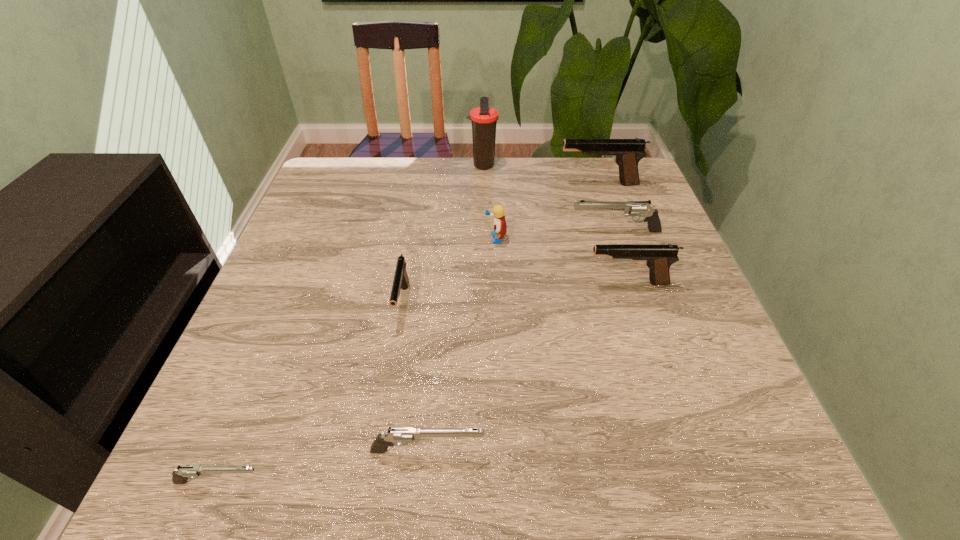
This screenshot has width=960, height=540. In order to click on vacant space that is in between the Lego and the biggest black pistol in this screenshot , I will do `click(547, 212)`.

I want to click on unoccupied position between the farthest object and the Lego, so click(489, 202).

Identify the location of free space between the second tallest object and the fifth shortest pistol. This screenshot has width=960, height=540. (612, 234).

Where is `free spot between the seventh farthest object and the leftmost black pistol`? The height and width of the screenshot is (540, 960). free spot between the seventh farthest object and the leftmost black pistol is located at coordinates (415, 377).

Identify the location of vacant space in between the Lego and the tallest pistol. (547, 212).

This screenshot has width=960, height=540. What are the coordinates of `vacant point located between the leftmost silver pistol and the second nearest pistol` in the screenshot? It's located at (324, 467).

Where is `vacant space in between the Lego and the smallest silver pistol`? vacant space in between the Lego and the smallest silver pistol is located at coordinates (357, 361).

Locate an element on the screen. The width and height of the screenshot is (960, 540). free space between the fifth shortest pistol and the tallest pistol is located at coordinates pyautogui.click(x=612, y=234).

You are a GUI agent. You are given a task and a screenshot of the screen. Output one action in this format:
    pyautogui.click(x=<x>, y=<y>)
    Task: Click on the free space between the thermos bottle and the nearest object
    This screenshot has height=540, width=960.
    Given the screenshot: What is the action you would take?
    pyautogui.click(x=351, y=323)

Locate which object ranks third in proximity to the smallest black pistol. Please provide its 2D coordinates. Your answer should be formatted as a tuple, i.e. [(x, y)], where the tuple contains the x and y coordinates of a point satisfying the conditions above.

[(180, 475)]